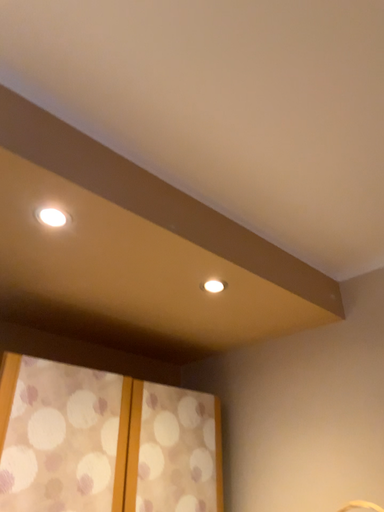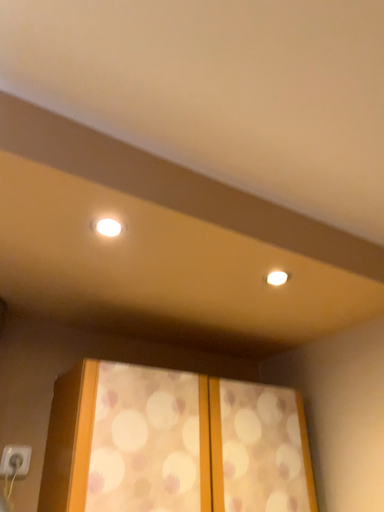
Question: How did the camera likely rotate when shooting the video?

Choices:
 (A) rotated left
 (B) rotated right

Answer: (A)